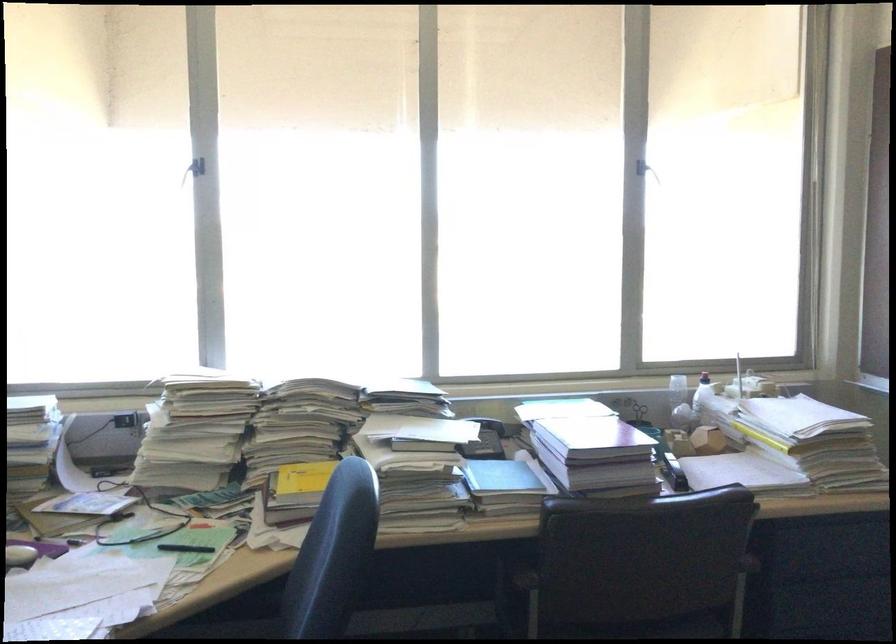
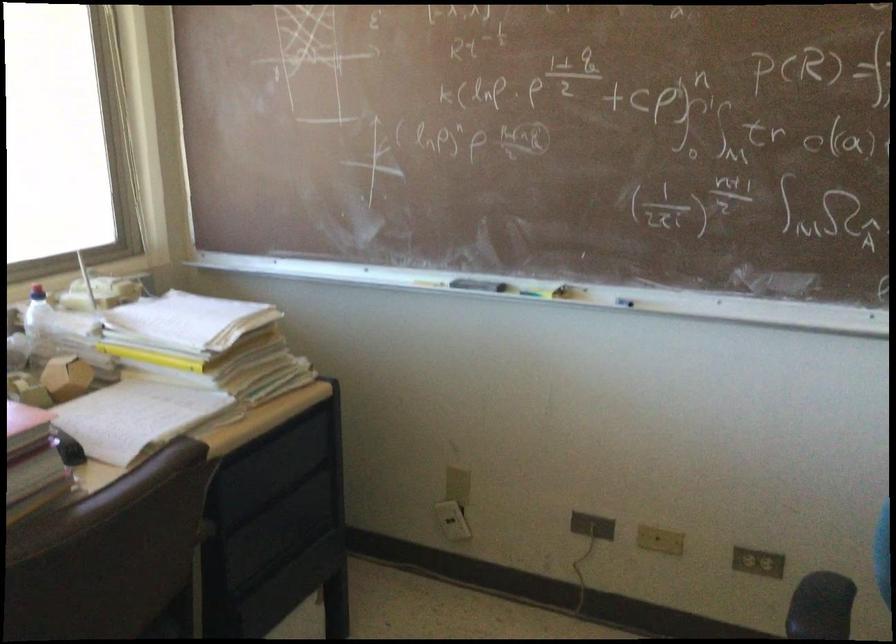
The point at (708, 393) is marked in the first image. Where is the corresponding point in the second image?

(37, 321)